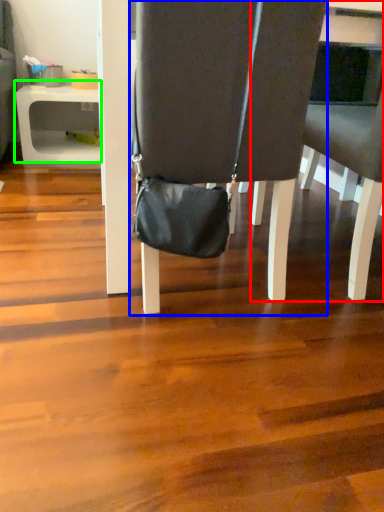
Question: Which object is the closest to the chair (highlighted by a red box)? Choose among these: chair (highlighted by a blue box) or table (highlighted by a green box).

Choices:
 (A) chair
 (B) table

Answer: (A)